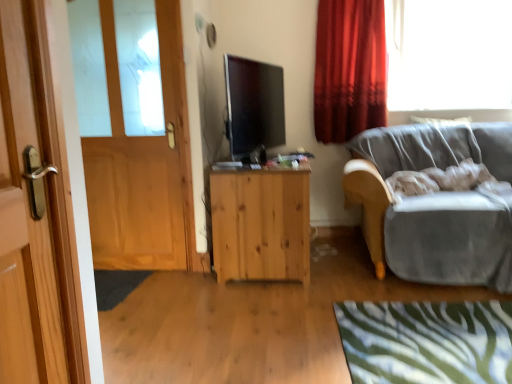
Where is `vacant space in green zebra-patterned rug at lower right (from a real-world perspective)`? This screenshot has width=512, height=384. vacant space in green zebra-patterned rug at lower right (from a real-world perspective) is located at coordinates (437, 334).